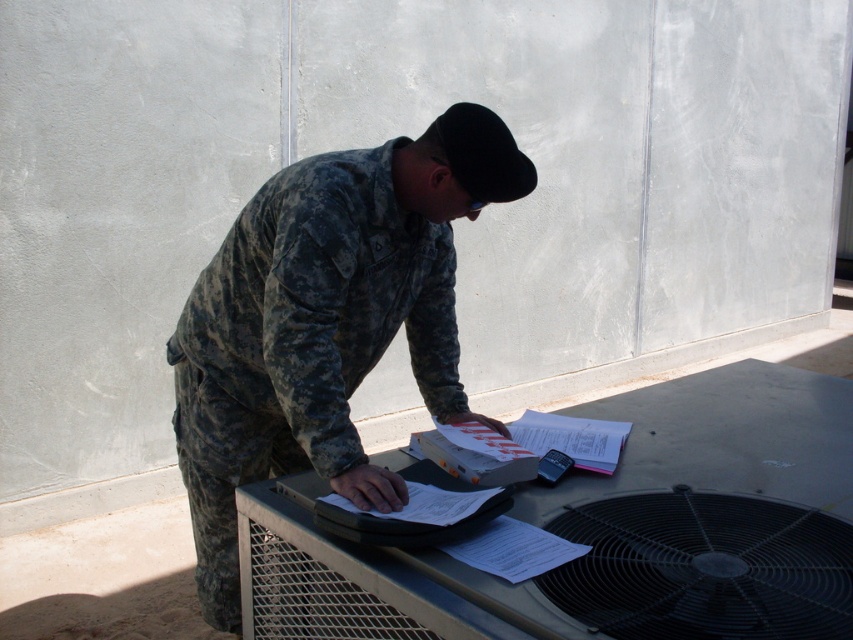
You are a maintenance worker needing to access the black metallic mechanical fan at lower right. The camouflage uniform at center is in your way. Can you move around it to reach the fan?

The camouflage uniform at center is further to the viewer than the black metallic mechanical fan at lower right, so you can move around it to reach the fan.

Based on the scene, where is the camouflage uniform at center located in relation to the black metallic mechanical fan at lower right?

The camouflage uniform at center is to the left of the black metallic mechanical fan at lower right.

You are a technician working on an outdoor air conditioning unit. You need to reach two points marked on the unit for maintenance. The first point is at coordinate point (x=466, y=141) and the second is at point (x=550, y=598). Which point should you attend to first if you want to work on the closer one first?

You should attend to point (x=466, y=141) first because it is closer to you than point (x=550, y=598), as point (x=466, y=141) is further to the viewer than point (x=550, y=598).